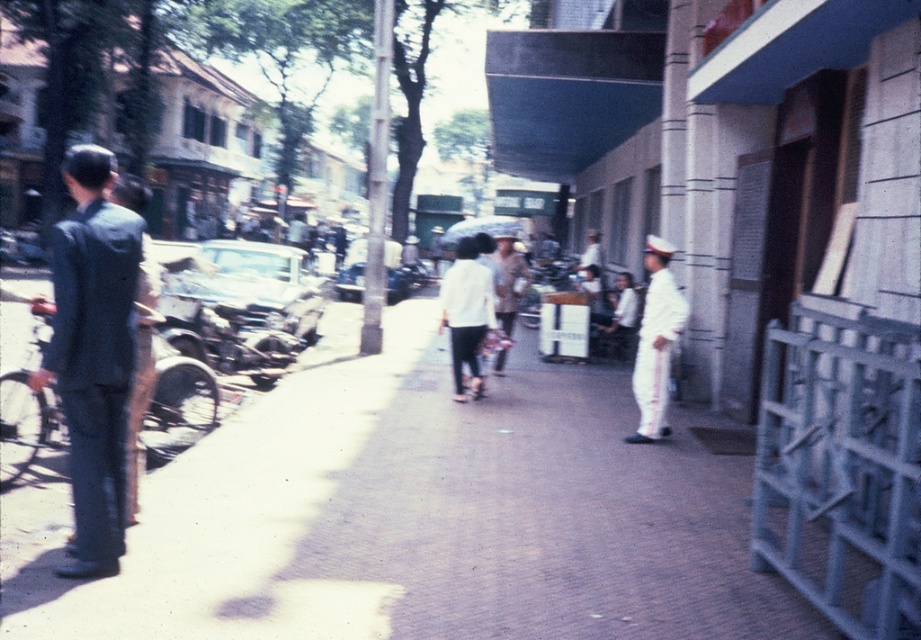
Which is more to the left, white matte shirt at center or light brown fabric shirt at center?

white matte shirt at center

Consider the image. Does white matte shirt at center have a lesser width compared to light brown fabric shirt at center?

No.

The image size is (921, 640). What do you see at coordinates (465, 312) in the screenshot?
I see `white matte shirt at center` at bounding box center [465, 312].

Identify the location of white matte shirt at center. This screenshot has width=921, height=640. (465, 312).

Is point (124, 269) closer to viewer compared to point (642, 385)?

Yes, it is.

Which is in front, point (127, 221) or point (640, 433)?

Point (127, 221)

Is point (91, 355) positioned after point (672, 285)?

No, (91, 355) is closer to viewer.

You are a GUI agent. You are given a task and a screenshot of the screen. Output one action in this format:
    pyautogui.click(x=<x>, y=<y>)
    Task: Click on the dark blue suit at left
    Image resolution: width=921 pixels, height=640 pixels.
    Given the screenshot: What is the action you would take?
    pyautogui.click(x=92, y=353)

Who is more distant from viewer, (662, 259) or (460, 228)?

The point (460, 228) is behind.

Does white uniform at right appear on the left side of transparent plastic umbrella at center?

In fact, white uniform at right is to the right of transparent plastic umbrella at center.

Is point (662, 253) positioned before point (494, 218)?

Yes, point (662, 253) is in front of point (494, 218).

What are the coordinates of `white uniform at right` in the screenshot? It's located at (656, 340).